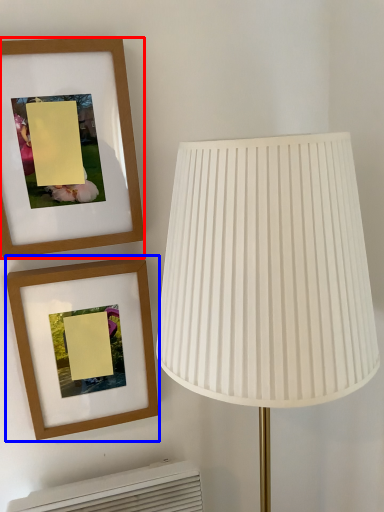
Question: Which point is further to the camera, picture frame (highlighted by a red box) or picture frame (highlighted by a blue box)?

Choices:
 (A) picture frame
 (B) picture frame

Answer: (B)